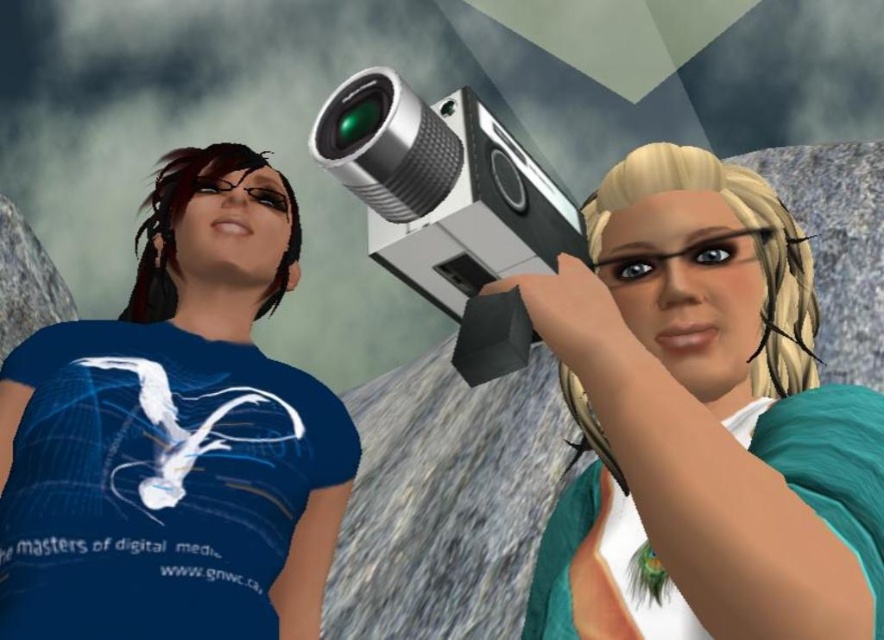
You are a photographer trying to set up a tripod for a group photo. The shiny silver camera at center is currently positioned between two characters. If the minimum distance required for the tripod legs to spread out is 60 centimeters, will the available space between the two characters suffice?

The shiny silver camera at center and camera are 63.33 centimeters apart from each other, which exceeds the minimum required distance of 60 centimeters. Therefore, the space between the two characters is sufficient for the tripod legs to spread out.